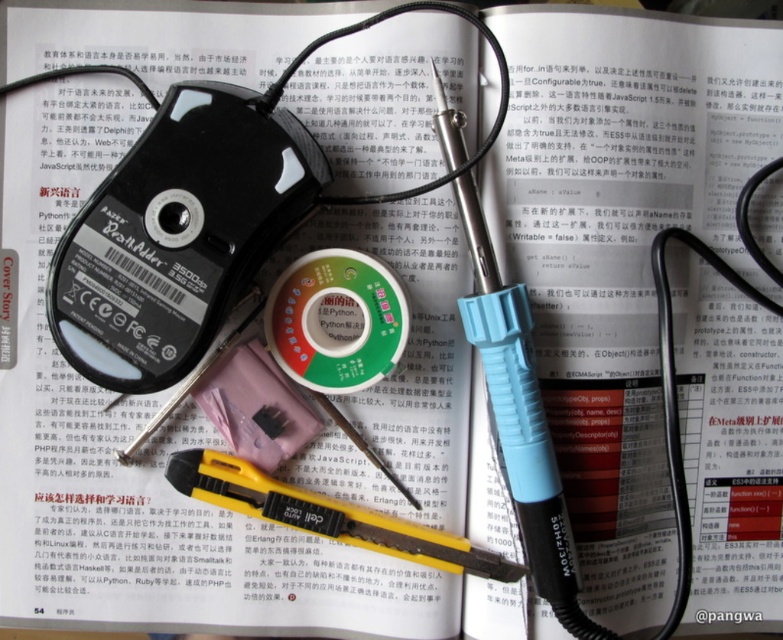
You are organizing a desk and need to place the black plastic ipod at center and the black plastic soldering iron at center. According to their positions in the image, which one should you move first to the right to make space for a new item?

The black plastic ipod at center is to the left of the black plastic soldering iron at center. To make space for a new item, you should move the black plastic soldering iron at center first to the right since it is already positioned to the right of the ipod.

Looking at this image, you are looking at the image of a computer mouse on an open book. There is a point labeled at coordinates point (179, 234). What object is located at that point?

The point (179, 234) corresponds to the black plastic ipod at center.

In the scene shown: You are organizing a display and want to stack the black plastic ipod at center and the black plastic soldering iron at center vertically. Which object should be placed at the bottom to ensure stability?

The black plastic soldering iron at center should be placed at the bottom because it is thicker than the black plastic ipod at center, providing a stable base for the stack.